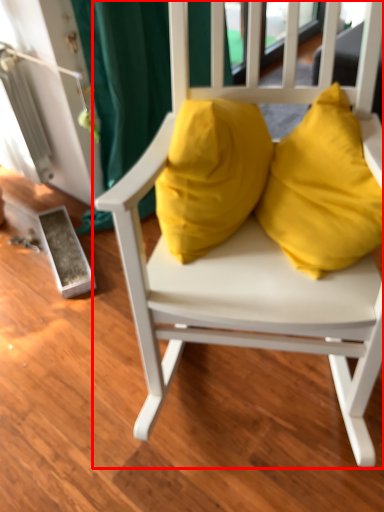
Question: From the image, what is the correct spatial relationship of chair (annotated by the red box) in relation to pillow?

Choices:
 (A) left
 (B) right

Answer: (B)